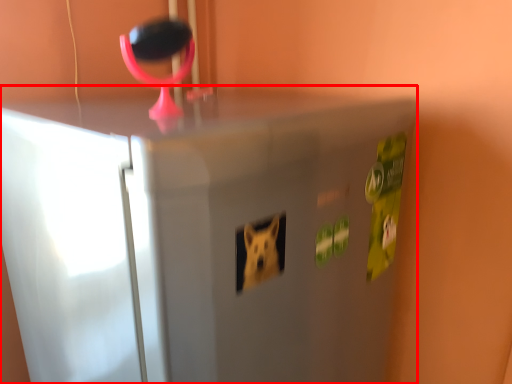
Question: From the image's perspective, where is refrigerator (annotated by the red box) located relative to magnifying glass?

Choices:
 (A) below
 (B) above

Answer: (A)